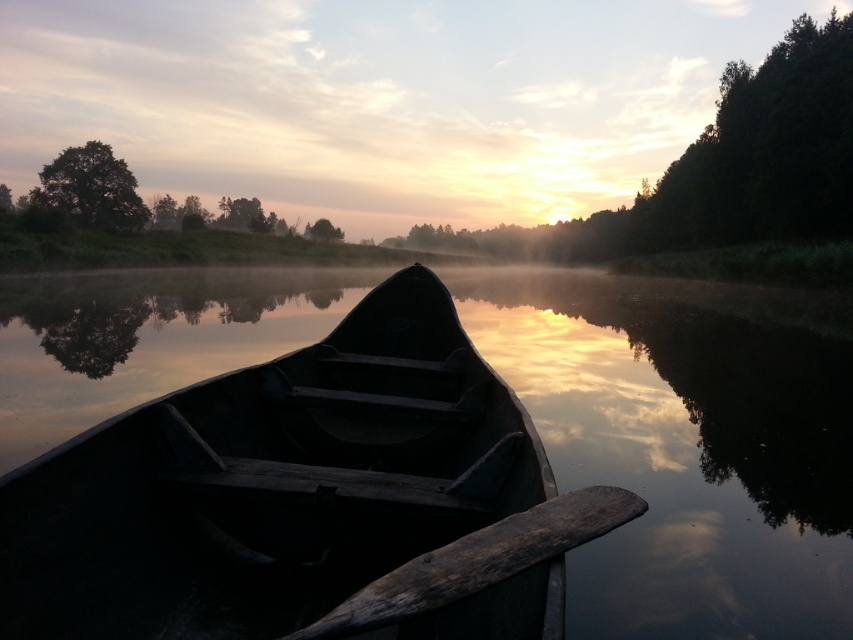
Question: Can you confirm if dark brown wooden paddle at center is positioned above green leafy tree at upper left?

Choices:
 (A) no
 (B) yes

Answer: (A)

Question: Which of these objects is positioned closest to the green leafy tree at upper left?

Choices:
 (A) dark wood boat at center
 (B) green matte tree at upper center
 (C) dark brown wooden paddle at center

Answer: (B)

Question: Does dark brown wooden paddle at center have a larger size compared to green matte tree at upper center?

Choices:
 (A) no
 (B) yes

Answer: (A)

Question: Which of these objects is positioned farthest from the green matte tree at upper center?

Choices:
 (A) dark brown wooden paddle at center
 (B) dark wood boat at center
 (C) green leafy tree at upper left

Answer: (A)

Question: Which point is farther to the camera?

Choices:
 (A) green leafy tree at upper left
 (B) dark wood boat at center

Answer: (A)

Question: Is green leafy tree at upper left behind green matte tree at upper center?

Choices:
 (A) no
 (B) yes

Answer: (A)